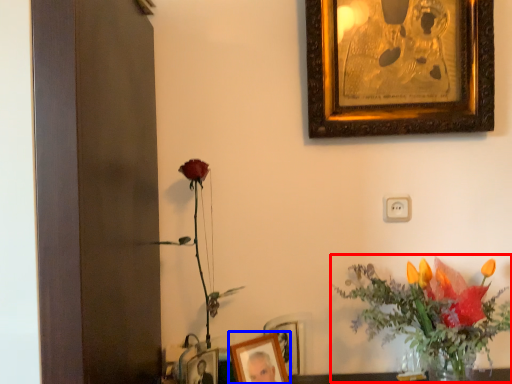
Question: Which object is closer to the camera taking this photo, floral arrangement (highlighted by a red box) or picture frame (highlighted by a blue box)?

Choices:
 (A) floral arrangement
 (B) picture frame

Answer: (A)